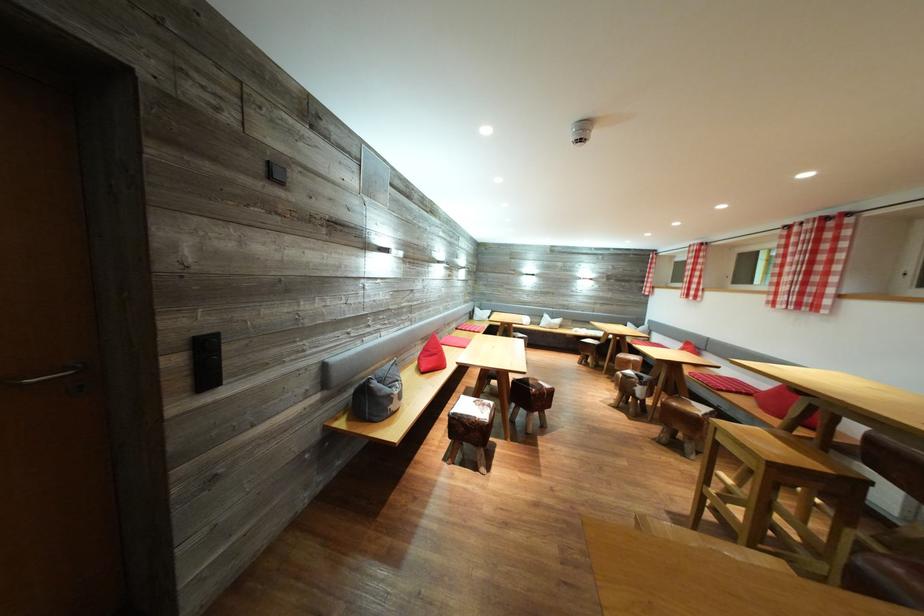
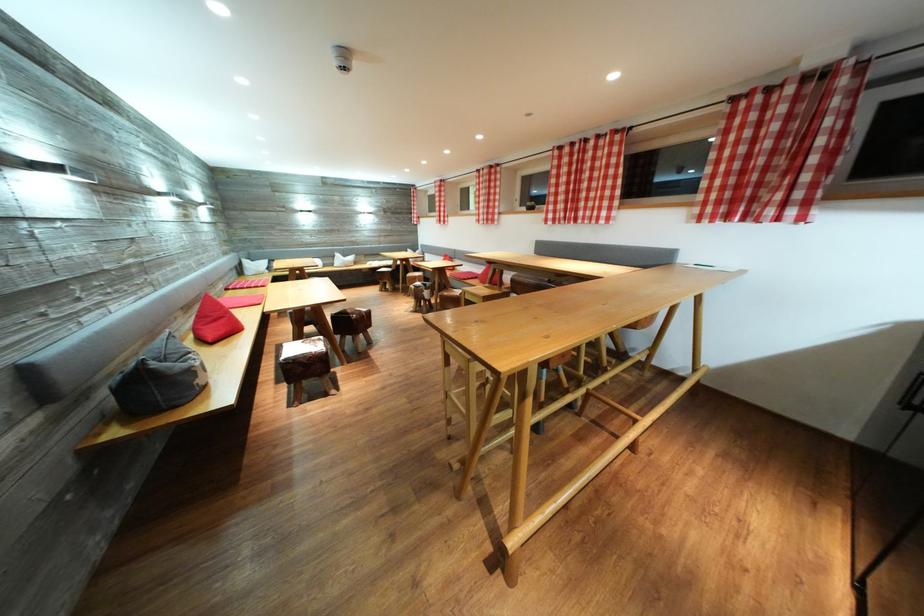
Locate, in the second image, the point that corresponds to point 541,400 in the first image.

(362, 325)